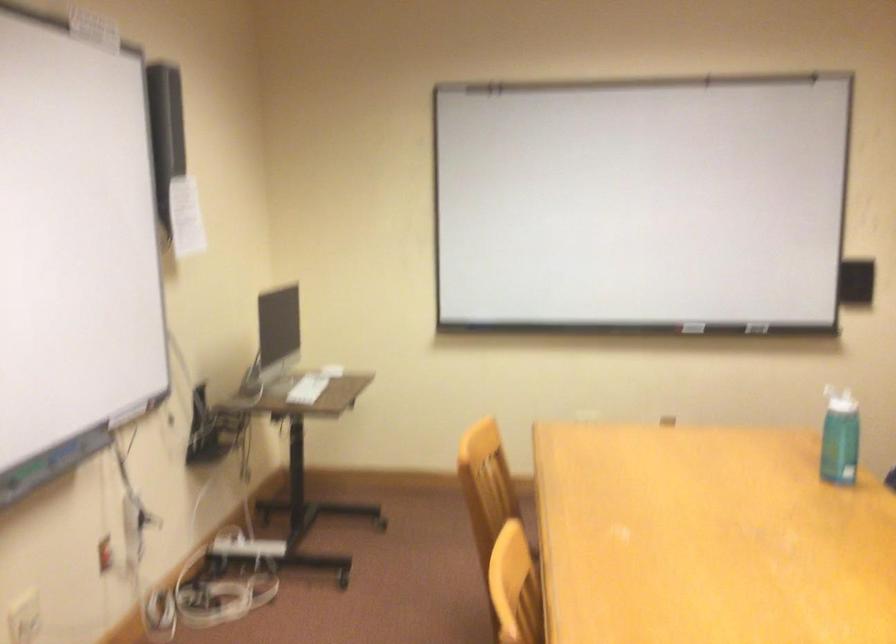
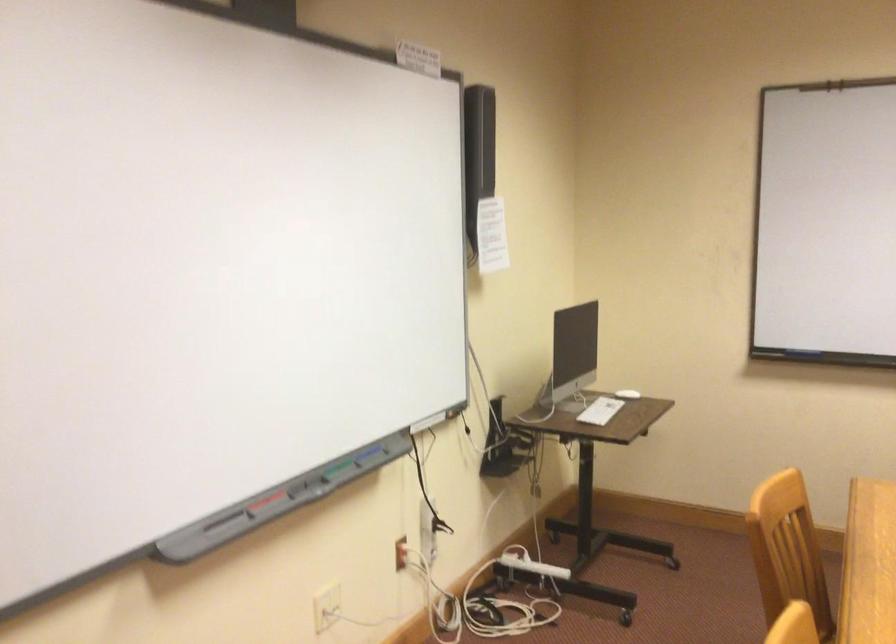
Question: The camera is either moving clockwise (left) or counter-clockwise (right) around the object. The first image is from the beginning of the video and the second image is from the end. Is the camera moving left or right when shooting the video?

Choices:
 (A) Left
 (B) Right

Answer: (B)